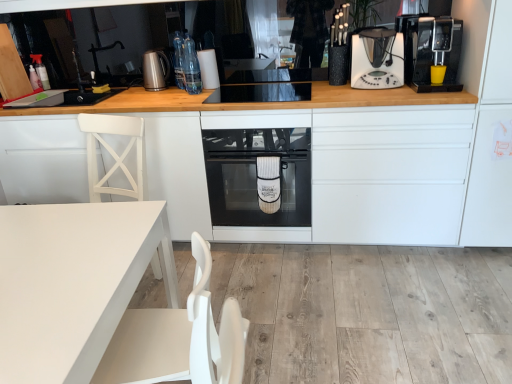
What is the approximate height of white matte table at lower left, the 1th cabinetry viewed from the left?

The height of white matte table at lower left, the 1th cabinetry viewed from the left, is 84.05 centimeters.

Measure the distance between white matte table at lower left, the 2th cabinetry positioned from the right, and camera.

A distance of 2.16 meters exists between white matte table at lower left, the 2th cabinetry positioned from the right, and camera.

The image size is (512, 384). Describe the element at coordinates (155, 70) in the screenshot. I see `brushed metal kettle at upper center, which is counted as the third kitchen appliance, starting from the right` at that location.

Describe the element at coordinates (430, 50) in the screenshot. The height and width of the screenshot is (384, 512). I see `black plastic coffee machine at upper right, the 1th kitchen appliance viewed from the right` at that location.

The width and height of the screenshot is (512, 384). What do you see at coordinates (377, 59) in the screenshot?
I see `white plastic coffee maker at upper right, acting as the second kitchen appliance starting from the right` at bounding box center [377, 59].

Locate an element on the screen. Image resolution: width=512 pixels, height=384 pixels. white matte table at lower left, the 1th cabinetry viewed from the left is located at coordinates (42, 159).

How different are the orientations of brushed metal kettle at upper center, which is the first kitchen appliance from left to right, and white matte table at lower left, the 1th cabinetry viewed from the left, in degrees?

The facing directions of brushed metal kettle at upper center, which is the first kitchen appliance from left to right, and white matte table at lower left, the 1th cabinetry viewed from the left, are 15.1 degrees apart.

Is brushed metal kettle at upper center, which is counted as the third kitchen appliance, starting from the right, completely or partially outside of white matte table at lower left, the 2th cabinetry positioned from the right?

Indeed, brushed metal kettle at upper center, which is counted as the third kitchen appliance, starting from the right, is completely outside white matte table at lower left, the 2th cabinetry positioned from the right.

Considering the sizes of objects brushed metal kettle at upper center, which is counted as the third kitchen appliance, starting from the right, and white matte table at lower left, the 1th cabinetry viewed from the left, in the image provided, who is bigger, brushed metal kettle at upper center, which is counted as the third kitchen appliance, starting from the right, or white matte table at lower left, the 1th cabinetry viewed from the left,?

white matte table at lower left, the 1th cabinetry viewed from the left, is bigger.

Considering the sizes of objects brushed metal kettle at upper center, which is counted as the third kitchen appliance, starting from the right, and white matte table at lower left, the 1th cabinetry viewed from the left, in the image provided, who is thinner, brushed metal kettle at upper center, which is counted as the third kitchen appliance, starting from the right, or white matte table at lower left, the 1th cabinetry viewed from the left,?

brushed metal kettle at upper center, which is counted as the third kitchen appliance, starting from the right, is thinner.

From a real-world perspective, is translucent plastic spray bottle at upper left, acting as the 2th bottle starting from the front, below white matte cabinet at center, which ranks as the second cabinetry in left-to-right order?

No, from a real-world perspective, translucent plastic spray bottle at upper left, acting as the 2th bottle starting from the front, is not below white matte cabinet at center, which ranks as the second cabinetry in left-to-right order.

How much distance is there between translucent plastic spray bottle at upper left, which is the first bottle from left to right, and white matte cabinet at center, marked as the 1th cabinetry in a right-to-left arrangement?

A distance of 6.12 feet exists between translucent plastic spray bottle at upper left, which is the first bottle from left to right, and white matte cabinet at center, marked as the 1th cabinetry in a right-to-left arrangement.

Can you confirm if translucent plastic spray bottle at upper left, which is the first bottle from left to right, is smaller than white matte cabinet at center, which ranks as the second cabinetry in left-to-right order?

Yes, translucent plastic spray bottle at upper left, which is the first bottle from left to right, is smaller than white matte cabinet at center, which ranks as the second cabinetry in left-to-right order.

Considering the relative sizes of black plastic coffee machine at upper right, positioned as the 3th kitchen appliance in left-to-right order, and white plastic coffee maker at upper right, acting as the second kitchen appliance starting from the right, in the image provided, is black plastic coffee machine at upper right, positioned as the 3th kitchen appliance in left-to-right order, wider than white plastic coffee maker at upper right, acting as the second kitchen appliance starting from the right,?

Yes, black plastic coffee machine at upper right, positioned as the 3th kitchen appliance in left-to-right order, is wider than white plastic coffee maker at upper right, acting as the second kitchen appliance starting from the right.

Is white plastic coffee maker at upper right, which appears as the 2th kitchen appliance when viewed from the left, at the back of black plastic coffee machine at upper right, positioned as the 3th kitchen appliance in left-to-right order?

No, black plastic coffee machine at upper right, positioned as the 3th kitchen appliance in left-to-right order, is not facing the opposite direction of white plastic coffee maker at upper right, which appears as the 2th kitchen appliance when viewed from the left.

From the image's perspective, relative to white plastic coffee maker at upper right, which appears as the 2th kitchen appliance when viewed from the left, is black plastic coffee machine at upper right, the 1th kitchen appliance viewed from the right, above or below?

From the image's perspective, black plastic coffee machine at upper right, the 1th kitchen appliance viewed from the right, appears below white plastic coffee maker at upper right, which appears as the 2th kitchen appliance when viewed from the left.

Where is `kitchen appliance positioned vertically above the white plastic coffee maker at upper right, which appears as the 2th kitchen appliance when viewed from the left (from a real-world perspective)`? This screenshot has width=512, height=384. kitchen appliance positioned vertically above the white plastic coffee maker at upper right, which appears as the 2th kitchen appliance when viewed from the left (from a real-world perspective) is located at coordinates (430, 50).

From the image's perspective, relative to black plastic coffee machine at upper right, the 1th kitchen appliance viewed from the right, is brushed metal kettle at upper center, which is the first kitchen appliance from left to right, above or below?

From the image's perspective, brushed metal kettle at upper center, which is the first kitchen appliance from left to right, appears above black plastic coffee machine at upper right, the 1th kitchen appliance viewed from the right.

From a real-world perspective, which object stands above the other?

From a 3D spatial view, black plastic coffee machine at upper right, positioned as the 3th kitchen appliance in left-to-right order, is above.

Which object is positioned more to the left, brushed metal kettle at upper center, which is counted as the third kitchen appliance, starting from the right, or black plastic coffee machine at upper right, the 1th kitchen appliance viewed from the right?

Positioned to the left is brushed metal kettle at upper center, which is counted as the third kitchen appliance, starting from the right.

Are brushed metal kettle at upper center, which is counted as the third kitchen appliance, starting from the right, and black plastic coffee machine at upper right, the 1th kitchen appliance viewed from the right, beside each other?

They are not placed beside each other.

In the image, is translucent plastic spray bottle at upper left, acting as the 2th bottle starting from the front, on the left side or the right side of white matte table at lower left?

Clearly, translucent plastic spray bottle at upper left, acting as the 2th bottle starting from the front, is on the left of white matte table at lower left in the image.

Looking at this image, in terms of height, does translucent plastic spray bottle at upper left, acting as the 2th bottle starting from the front, look taller or shorter compared to white matte table at lower left?

In the image, translucent plastic spray bottle at upper left, acting as the 2th bottle starting from the front, appears to be shorter than white matte table at lower left.

Is translucent plastic spray bottle at upper left, which is the first bottle from left to right, situated inside white matte table at lower left or outside?

The correct answer is: outside.

Find the location of a particular element. The image size is (512, 384). bottle lying on the left of white matte table at lower left is located at coordinates [x=41, y=70].

Who is shorter, white plastic coffee maker at upper right, which appears as the 2th kitchen appliance when viewed from the left, or translucent plastic spray bottle at upper left, which is the first bottle from left to right?

translucent plastic spray bottle at upper left, which is the first bottle from left to right, is shorter.

From the white plastic coffee maker at upper right, which appears as the 2th kitchen appliance when viewed from the left, count 2nd bottles backward and point to it. Please provide its 2D coordinates.

[(41, 70)]

Which object is thinner, white plastic coffee maker at upper right, acting as the second kitchen appliance starting from the right, or translucent plastic spray bottle at upper left, acting as the 2th bottle starting from the front?

translucent plastic spray bottle at upper left, acting as the 2th bottle starting from the front.

Is white plastic coffee maker at upper right, acting as the second kitchen appliance starting from the right, directly adjacent to translucent plastic spray bottle at upper left, the second bottle in the right-to-left sequence?

No, white plastic coffee maker at upper right, acting as the second kitchen appliance starting from the right, is not beside translucent plastic spray bottle at upper left, the second bottle in the right-to-left sequence.

Choose the correct answer: Is brushed metal kettle at upper center, which is counted as the third kitchen appliance, starting from the right, inside clear glass bottles at upper center, placed as the 2th bottle when sorted from back to front, or outside it?

brushed metal kettle at upper center, which is counted as the third kitchen appliance, starting from the right, is not enclosed by clear glass bottles at upper center, placed as the 2th bottle when sorted from back to front.

In terms of size, does brushed metal kettle at upper center, which is the first kitchen appliance from left to right, appear bigger or smaller than clear glass bottles at upper center, which is counted as the first bottle, starting from the right?

In the image, brushed metal kettle at upper center, which is the first kitchen appliance from left to right, appears to be larger than clear glass bottles at upper center, which is counted as the first bottle, starting from the right.

Does brushed metal kettle at upper center, which is the first kitchen appliance from left to right, have a greater width compared to clear glass bottles at upper center, which is counted as the first bottle, starting from the right?

Yes, brushed metal kettle at upper center, which is the first kitchen appliance from left to right, is wider than clear glass bottles at upper center, which is counted as the first bottle, starting from the right.

Which object is positioned more to the left, brushed metal kettle at upper center, which is the first kitchen appliance from left to right, or clear glass bottles at upper center, placed as the 1th bottle when sorted from front to back?

brushed metal kettle at upper center, which is the first kitchen appliance from left to right.

Image resolution: width=512 pixels, height=384 pixels. I want to click on the 1st kitchen appliance to the right of the white matte table at lower left, the 2th cabinetry positioned from the right, starting your count from the anchor, so click(155, 70).

Where is `bottle that is the 1st object above the white matte cabinet at center, which ranks as the second cabinetry in left-to-right order (from a real-world perspective)`? The height and width of the screenshot is (384, 512). bottle that is the 1st object above the white matte cabinet at center, which ranks as the second cabinetry in left-to-right order (from a real-world perspective) is located at coordinates (41, 70).

From the image, which object appears to be farther from black plastic coffee machine at right, white plastic coffee maker at upper right, which appears as the 2th kitchen appliance when viewed from the left, or white matte cabinet at center, which ranks as the second cabinetry in left-to-right order?

white plastic coffee maker at upper right, which appears as the 2th kitchen appliance when viewed from the left, is further to black plastic coffee machine at right.

Based on their spatial positions, is white matte table at lower left or black plastic coffee machine at upper right, positioned as the 3th kitchen appliance in left-to-right order, closer to white matte cabinet at center, which ranks as the second cabinetry in left-to-right order?

The object closer to white matte cabinet at center, which ranks as the second cabinetry in left-to-right order, is black plastic coffee machine at upper right, positioned as the 3th kitchen appliance in left-to-right order.

Which object lies further to the anchor point black glass oven at center, white matte table at lower left, the 2th cabinetry positioned from the right, or black plastic coffee machine at right?

black plastic coffee machine at right.

Which object lies nearer to the anchor point black glass oven at center, black plastic coffee machine at upper right, the 1th kitchen appliance viewed from the right, or clear glass bottles at upper center, the second bottle viewed from the left?

Among the two, clear glass bottles at upper center, the second bottle viewed from the left, is located nearer to black glass oven at center.

Based on their spatial positions, is black plastic coffee machine at upper right, the 1th kitchen appliance viewed from the right, or white matte table at lower left, the 2th cabinetry positioned from the right, further from translucent plastic spray bottle at upper left, the second bottle in the right-to-left sequence?

The object further to translucent plastic spray bottle at upper left, the second bottle in the right-to-left sequence, is black plastic coffee machine at upper right, the 1th kitchen appliance viewed from the right.

Consider the image. When comparing their distances from brushed metal kettle at upper center, which is the first kitchen appliance from left to right, does white matte cabinet at center, marked as the 1th cabinetry in a right-to-left arrangement, or black plastic coffee machine at right seem closer?

white matte cabinet at center, marked as the 1th cabinetry in a right-to-left arrangement, is closer to brushed metal kettle at upper center, which is the first kitchen appliance from left to right.

From the image, which object appears to be farther from black plastic coffee machine at upper right, the 1th kitchen appliance viewed from the right, brushed metal kettle at upper center, which is the first kitchen appliance from left to right, or white plastic coffee maker at upper right, which appears as the 2th kitchen appliance when viewed from the left?

Based on the image, brushed metal kettle at upper center, which is the first kitchen appliance from left to right, appears to be further to black plastic coffee machine at upper right, the 1th kitchen appliance viewed from the right.

Looking at the image, which one is located closer to black plastic coffee machine at right, translucent plastic spray bottle at upper left, the second bottle in the right-to-left sequence, or white matte table at lower left?

white matte table at lower left is closer to black plastic coffee machine at right.

The height and width of the screenshot is (384, 512). I want to click on bottle located between brushed metal kettle at upper center, which is the first kitchen appliance from left to right, and black glass oven at center in the left-right direction, so (191, 67).

Where is `home appliance between white matte table at lower left and black plastic coffee machine at upper right, the 1th kitchen appliance viewed from the right, in the horizontal direction`? home appliance between white matte table at lower left and black plastic coffee machine at upper right, the 1th kitchen appliance viewed from the right, in the horizontal direction is located at coordinates (256, 175).

At what (x,y) coordinates should I click in order to perform the action: click on cabinetry located between white matte table at lower left, the 1th cabinetry viewed from the left, and black plastic coffee machine at upper right, positioned as the 3th kitchen appliance in left-to-right order, in the left-right direction. Please return your answer as a coordinate pair (x, y). This screenshot has height=384, width=512. Looking at the image, I should click on (377, 178).

Where is `kitchen appliance between translucent plastic spray bottle at upper left, the second bottle in the right-to-left sequence, and black glass oven at center`? The image size is (512, 384). kitchen appliance between translucent plastic spray bottle at upper left, the second bottle in the right-to-left sequence, and black glass oven at center is located at coordinates (155, 70).